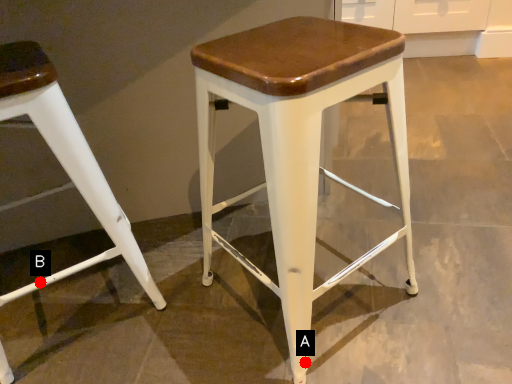
Question: Two points are circled on the image, labeled by A and B beside each circle. Which point is further to the camera?

Choices:
 (A) A is further
 (B) B is further

Answer: (B)